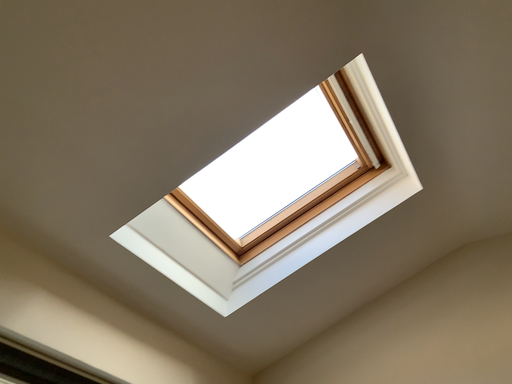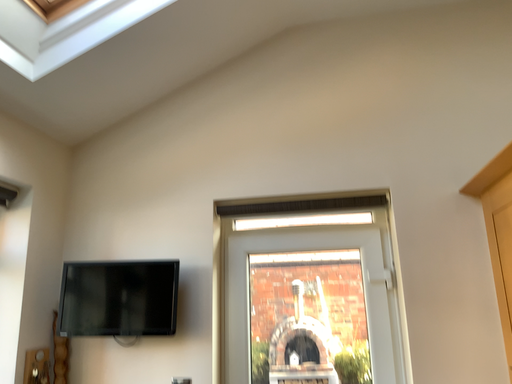
Question: Which way did the camera rotate in the video?

Choices:
 (A) rotated upward
 (B) rotated downward

Answer: (B)